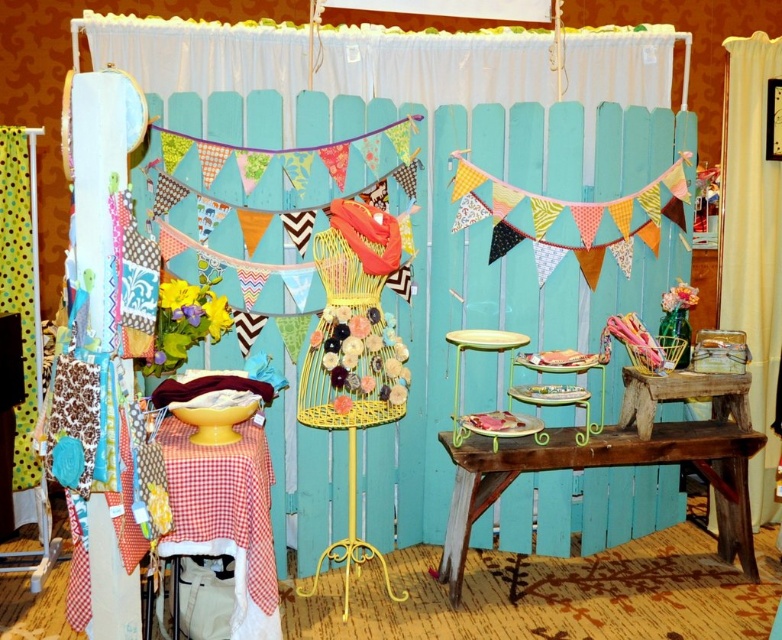
Between rustic wood table at center and rustic wood table at lower right, which one has less height?

rustic wood table at lower right is shorter.

Does point (727, 460) come in front of point (737, 390)?

No, (727, 460) is behind (737, 390).

Image resolution: width=782 pixels, height=640 pixels. What are the coordinates of `rustic wood table at center` in the screenshot? It's located at (601, 467).